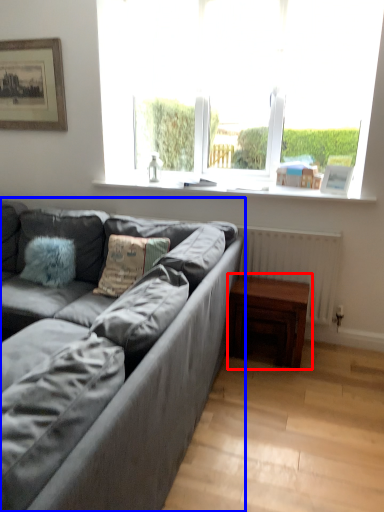
Question: Which object appears closest to the camera in this image, table (highlighted by a red box) or studio couch (highlighted by a blue box)?

Choices:
 (A) table
 (B) studio couch

Answer: (B)